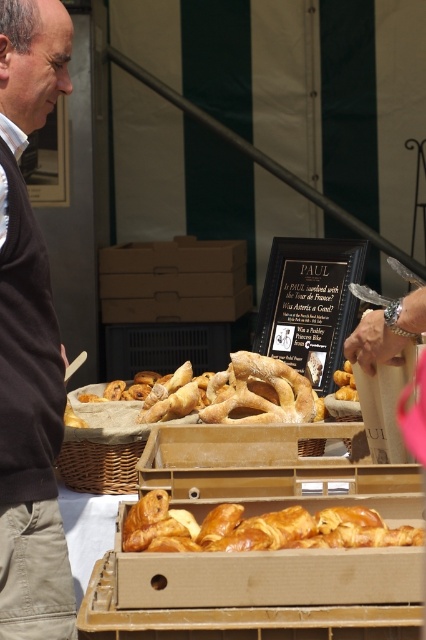
You are at a bakery stall and want to know if the brown sweater at left can completely cover the golden brown flaky croissant at center. Based on their sizes, what do you think?

The brown sweater at left is larger in size than the golden brown flaky croissant at center, so yes, the brown sweater at left can completely cover the golden brown flaky croissant at center.

You are a customer at the bakery stall and want to point out the golden brown flaky croissant at center to the person in the brown sweater at left. Which object should you point to first if you want to indicate the taller one?

The brown sweater at left is much taller as golden brown flaky croissant at center, so you should point to the brown sweater at left first.